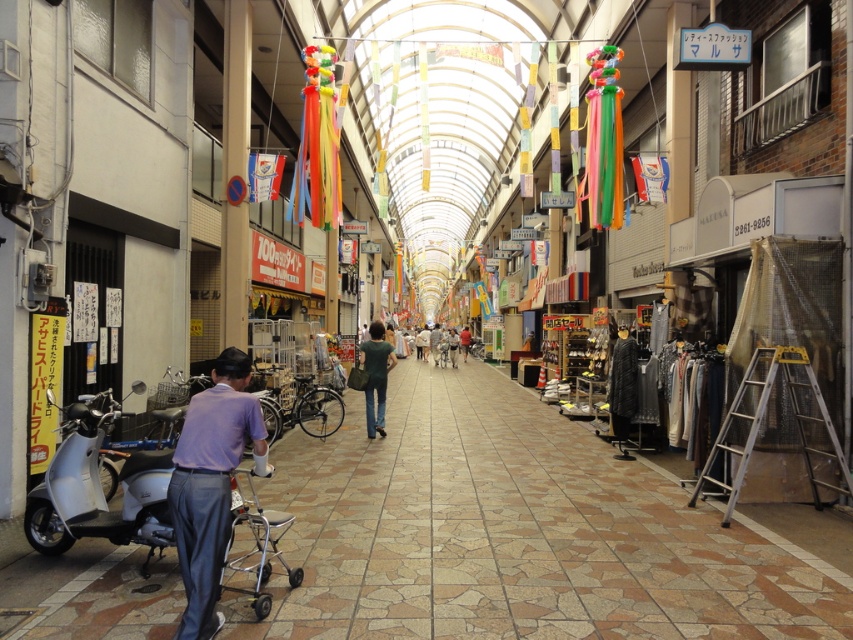
Question: Is silver metallic walker at lower left closer to the viewer compared to light blue shirt at center?

Choices:
 (A) no
 (B) yes

Answer: (B)

Question: Which of these objects is positioned farthest from the metallic scooter at lower left?

Choices:
 (A) silver metallic ladder at lower right
 (B) light blue shirt at center
 (C) silver metallic walker at lower left
 (D) dark green fabric shirt at center

Answer: (B)

Question: From the image, what is the correct spatial relationship of metallic scooter at lower left in relation to white matte motorcycle at lower left?

Choices:
 (A) left
 (B) right

Answer: (B)

Question: Which point is farther to the camera?

Choices:
 (A) (366, 352)
 (B) (283, 525)

Answer: (A)

Question: Which point is farther to the camera?

Choices:
 (A) (727, 436)
 (B) (161, 508)
 (C) (221, 420)

Answer: (A)

Question: Is white matte motorcycle at lower left above dark green fabric shirt at center?

Choices:
 (A) no
 (B) yes

Answer: (A)